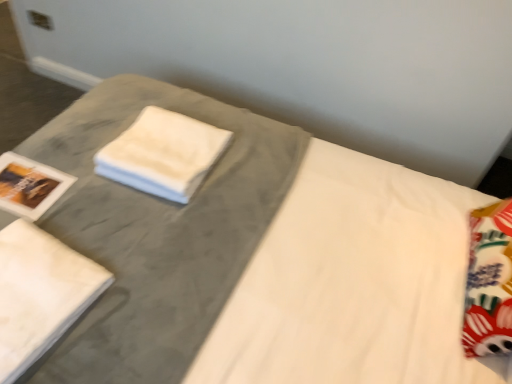
Question: From the image's perspective, relative to white cotton bath towel at lower left, is white soft cloth at center above or below?

Choices:
 (A) above
 (B) below

Answer: (A)

Question: Choose the correct answer: Is white soft cloth at center inside white cotton bath towel at lower left or outside it?

Choices:
 (A) inside
 (B) outside

Answer: (B)

Question: Considering the positions of white soft cloth at center and white cotton bath towel at lower left in the image, is white soft cloth at center bigger or smaller than white cotton bath towel at lower left?

Choices:
 (A) small
 (B) big

Answer: (B)

Question: Relative to white soft cloth at center, is white cotton bath towel at lower left in front or behind?

Choices:
 (A) behind
 (B) front

Answer: (B)

Question: Is white cotton bath towel at lower left to the left or to the right of white soft cloth at center in the image?

Choices:
 (A) right
 (B) left

Answer: (B)

Question: From the image's perspective, is white cotton bath towel at lower left above or below white soft cloth at center?

Choices:
 (A) above
 (B) below

Answer: (B)

Question: From their relative heights in the image, would you say white cotton bath towel at lower left is taller or shorter than white soft cloth at center?

Choices:
 (A) short
 (B) tall

Answer: (A)